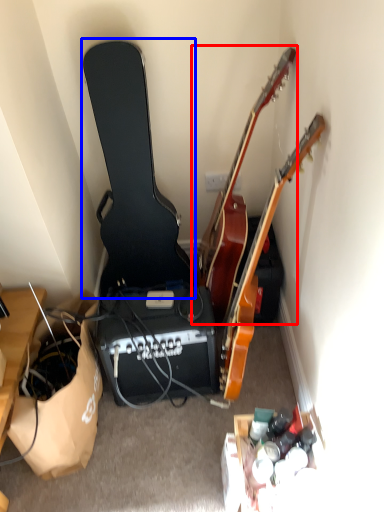
Question: Which of the following is the closest to the observer, guitar (highlighted by a red box) or guitar (highlighted by a blue box)?

Choices:
 (A) guitar
 (B) guitar

Answer: (A)